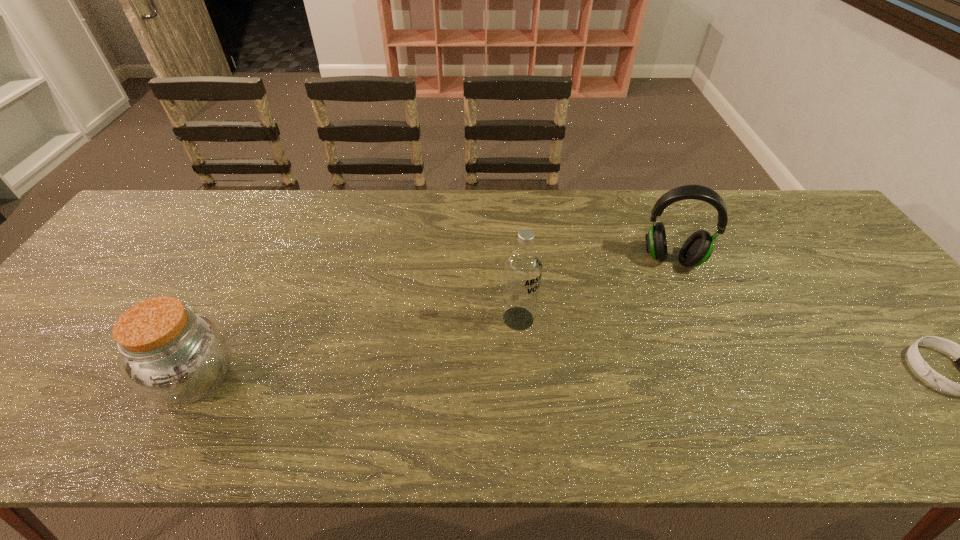
Locate an element on the screen. The image size is (960, 540). vacant area that lies between the jar and the farthest object is located at coordinates (434, 319).

Identify the location of unoccupied area between the leftmost object and the third object from left to right. The height and width of the screenshot is (540, 960). (434, 319).

Find the location of a particular element. This screenshot has height=540, width=960. free spot between the headset and the third nearest object is located at coordinates (595, 289).

Locate which object is the closest to the farthest object. Please provide its 2D coordinates. Your answer should be formatted as a tuple, i.e. [(x, y)], where the tuple contains the x and y coordinates of a point satisfying the conditions above.

[(523, 267)]

Locate an element on the screen. The image size is (960, 540). the third closest object to the third object from left to right is located at coordinates (169, 353).